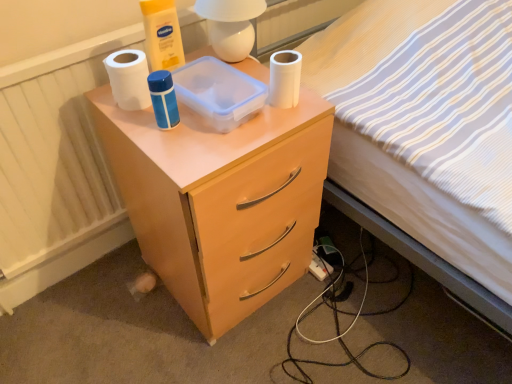
Question: Does white matte toilet paper at upper center, which appears as the 2th toilet paper when viewed from the left, have a lesser height compared to white plastic power outlet at lower right?

Choices:
 (A) no
 (B) yes

Answer: (A)

Question: Considering the relative sizes of white matte toilet paper at upper center, which appears as the 2th toilet paper when viewed from the left, and white plastic power outlet at lower right in the image provided, is white matte toilet paper at upper center, which appears as the 2th toilet paper when viewed from the left, wider than white plastic power outlet at lower right?

Choices:
 (A) yes
 (B) no

Answer: (B)

Question: Is the position of white matte toilet paper at upper center, which appears as the 2th toilet paper when viewed from the left, less distant than that of white plastic power outlet at lower right?

Choices:
 (A) yes
 (B) no

Answer: (A)

Question: Can you confirm if white matte toilet paper at upper center, which is counted as the first toilet paper, starting from the right, is bigger than white plastic power outlet at lower right?

Choices:
 (A) yes
 (B) no

Answer: (A)

Question: Is white matte toilet paper at upper center, which appears as the 2th toilet paper when viewed from the left, facing towards white plastic power outlet at lower right?

Choices:
 (A) no
 (B) yes

Answer: (A)

Question: Is white matte toilet paper at upper center, which appears as the 2th toilet paper when viewed from the left, behind white plastic power outlet at lower right?

Choices:
 (A) no
 (B) yes

Answer: (A)

Question: Can you confirm if white matte toilet paper at upper center, which is counted as the first toilet paper, starting from the right, is bigger than white striped fabric at upper right?

Choices:
 (A) no
 (B) yes

Answer: (A)

Question: From the image's perspective, is white matte toilet paper at upper center, which appears as the 2th toilet paper when viewed from the left, above white striped fabric at upper right?

Choices:
 (A) yes
 (B) no

Answer: (A)

Question: From a real-world perspective, is white matte toilet paper at upper center, which is counted as the first toilet paper, starting from the right, over white striped fabric at upper right?

Choices:
 (A) yes
 (B) no

Answer: (A)

Question: Is white matte toilet paper at upper center, which appears as the 2th toilet paper when viewed from the left, at the right side of white striped fabric at upper right?

Choices:
 (A) yes
 (B) no

Answer: (B)

Question: Is white matte toilet paper at upper center, which is counted as the first toilet paper, starting from the right, to the left of white striped fabric at upper right from the viewer's perspective?

Choices:
 (A) no
 (B) yes

Answer: (B)

Question: Can you confirm if white matte toilet paper at upper center, which appears as the 2th toilet paper when viewed from the left, is wider than white striped fabric at upper right?

Choices:
 (A) no
 (B) yes

Answer: (A)

Question: Is matte wood nightstand at center bigger than white striped fabric at upper right?

Choices:
 (A) no
 (B) yes

Answer: (A)